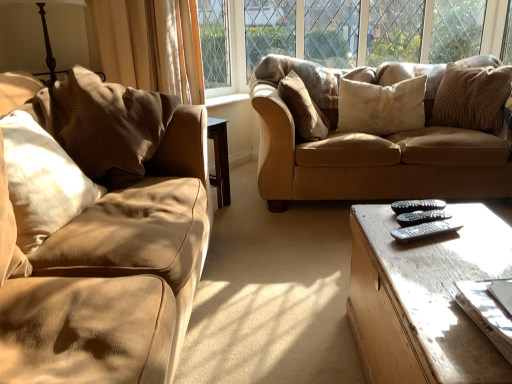
Question: Does brown corduroy pillow at upper right, positioned as the fifth pillow in left-to-right order, have a greater width compared to black plastic remote at center, positioned as the third remote in front-to-back order?

Choices:
 (A) no
 (B) yes

Answer: (B)

Question: Is brown corduroy pillow at upper right, positioned as the fifth pillow in left-to-right order, at the left side of black plastic remote at center, positioned as the third remote in front-to-back order?

Choices:
 (A) yes
 (B) no

Answer: (B)

Question: From a real-world perspective, is brown corduroy pillow at upper right, positioned as the fifth pillow in left-to-right order, on black plastic remote at center, positioned as the third remote in front-to-back order?

Choices:
 (A) yes
 (B) no

Answer: (A)

Question: Is brown corduroy pillow at upper right, marked as the 1th pillow in a right-to-left arrangement, far from black plastic remote at center, positioned as the third remote in front-to-back order?

Choices:
 (A) no
 (B) yes

Answer: (B)

Question: Can you confirm if brown corduroy pillow at upper right, positioned as the fifth pillow in left-to-right order, is smaller than black plastic remote at center, positioned as the third remote in front-to-back order?

Choices:
 (A) yes
 (B) no

Answer: (B)

Question: From the image's perspective, is matte brown couch at center positioned above or below black plastic remote at center, arranged as the first remote when viewed from the back?

Choices:
 (A) below
 (B) above

Answer: (B)

Question: Is point (494, 196) closer or farther from the camera than point (404, 210)?

Choices:
 (A) closer
 (B) farther

Answer: (B)

Question: From their relative heights in the image, would you say matte brown couch at center is taller or shorter than black plastic remote at center, arranged as the first remote when viewed from the back?

Choices:
 (A) short
 (B) tall

Answer: (B)

Question: Looking at their shapes, would you say matte brown couch at center is wider or thinner than black plastic remote at center, arranged as the first remote when viewed from the back?

Choices:
 (A) wide
 (B) thin

Answer: (A)

Question: From a real-world perspective, is black plastic remote at center, which ranks as the 2th remote in back-to-front order, above or below black plastic remote at center, positioned as the third remote in front-to-back order?

Choices:
 (A) above
 (B) below

Answer: (B)

Question: Based on their positions, is black plastic remote at center, which ranks as the 2th remote in back-to-front order, located to the left or right of black plastic remote at center, positioned as the third remote in front-to-back order?

Choices:
 (A) left
 (B) right

Answer: (A)

Question: Looking at their shapes, would you say black plastic remote at center, which ranks as the 2th remote in back-to-front order, is wider or thinner than black plastic remote at center, positioned as the third remote in front-to-back order?

Choices:
 (A) thin
 (B) wide

Answer: (B)

Question: From the image's perspective, relative to black plastic remote at center, positioned as the third remote in front-to-back order, is black plastic remote at center, the 2th remote when ordered from front to back, above or below?

Choices:
 (A) below
 (B) above

Answer: (A)

Question: In terms of height, does light brown wooden coffee table at lower right look taller or shorter compared to black plastic remote at center, arranged as the first remote when viewed from the back?

Choices:
 (A) short
 (B) tall

Answer: (B)

Question: Considering the positions of light brown wooden coffee table at lower right and black plastic remote at center, arranged as the first remote when viewed from the back, in the image, is light brown wooden coffee table at lower right bigger or smaller than black plastic remote at center, arranged as the first remote when viewed from the back,?

Choices:
 (A) small
 (B) big

Answer: (B)